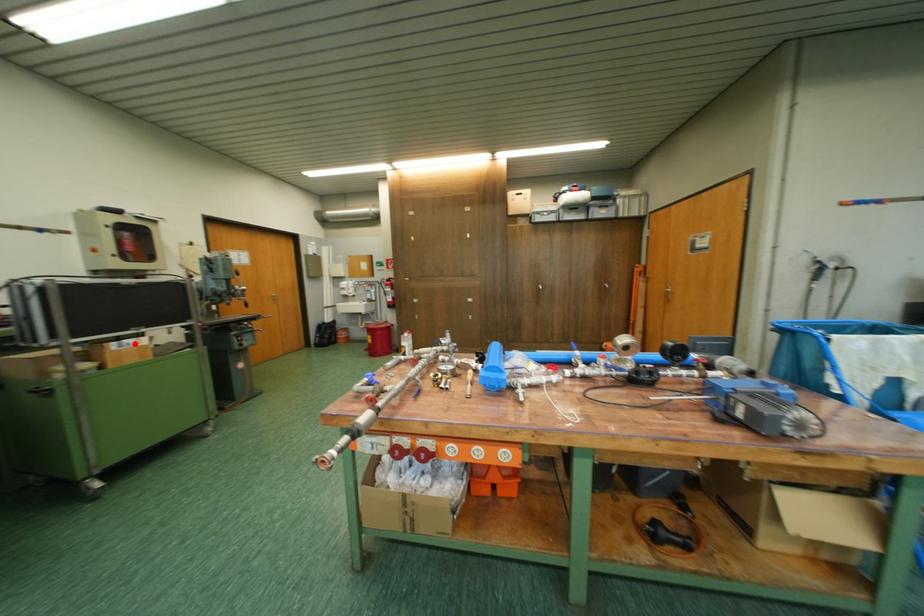
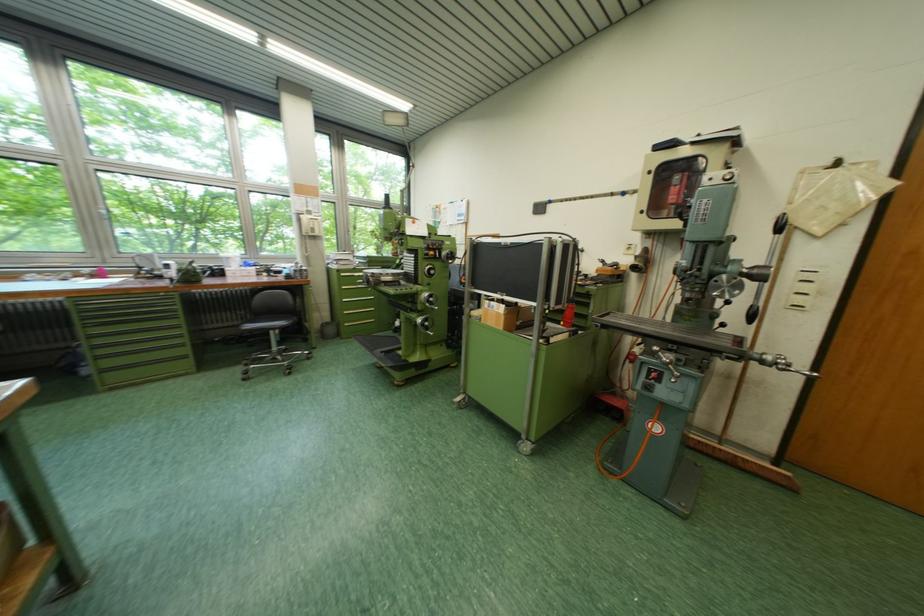
Locate, in the second image, the point that corresponds to the highlighted location in the first image.

(503, 305)